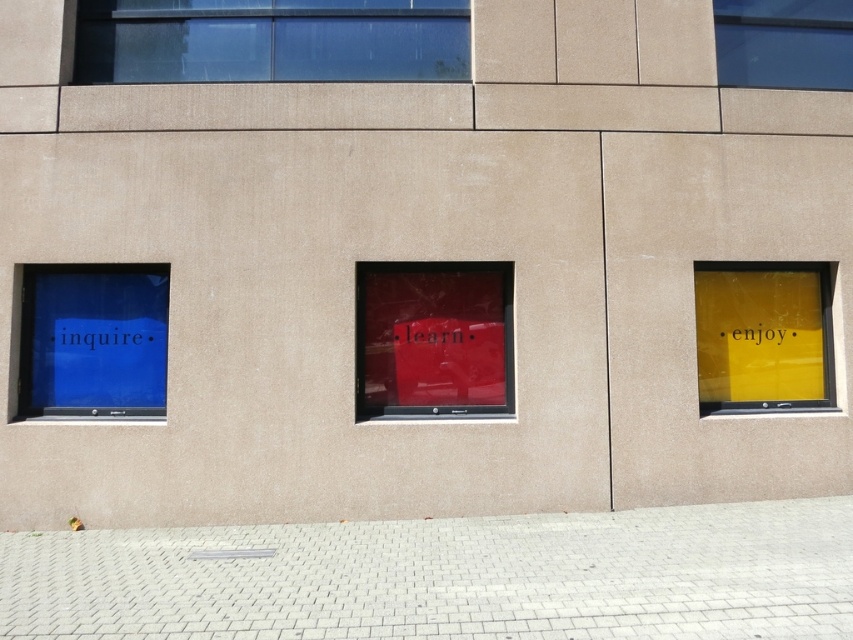
Question: From the image, what is the correct spatial relationship of transparent glass window at upper center in relation to yellow matte sign at right?

Choices:
 (A) right
 (B) left

Answer: (B)

Question: Among these points, which one is nearest to the camera?

Choices:
 (A) (824, 352)
 (B) (93, 360)
 (C) (746, 84)

Answer: (B)

Question: Which of the following is the closest to the observer?

Choices:
 (A) (361, 44)
 (B) (405, 371)
 (C) (96, 388)
 (D) (729, 353)

Answer: (C)

Question: Can you confirm if transparent glass window at upper center is thinner than matte red sign at center?

Choices:
 (A) no
 (B) yes

Answer: (A)

Question: Which point is closer to the camera?

Choices:
 (A) transparent glass window at upper right
 (B) yellow matte sign at right

Answer: (B)

Question: Does blue matte sign at left have a lesser width compared to yellow matte sign at right?

Choices:
 (A) no
 (B) yes

Answer: (B)